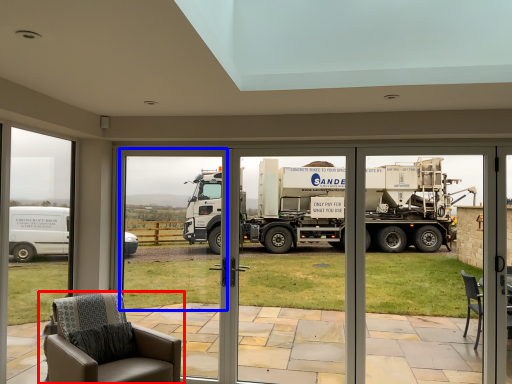
Question: Which of the following is the closest to the observer, chair (highlighted by a red box) or window screen (highlighted by a blue box)?

Choices:
 (A) chair
 (B) window screen

Answer: (A)